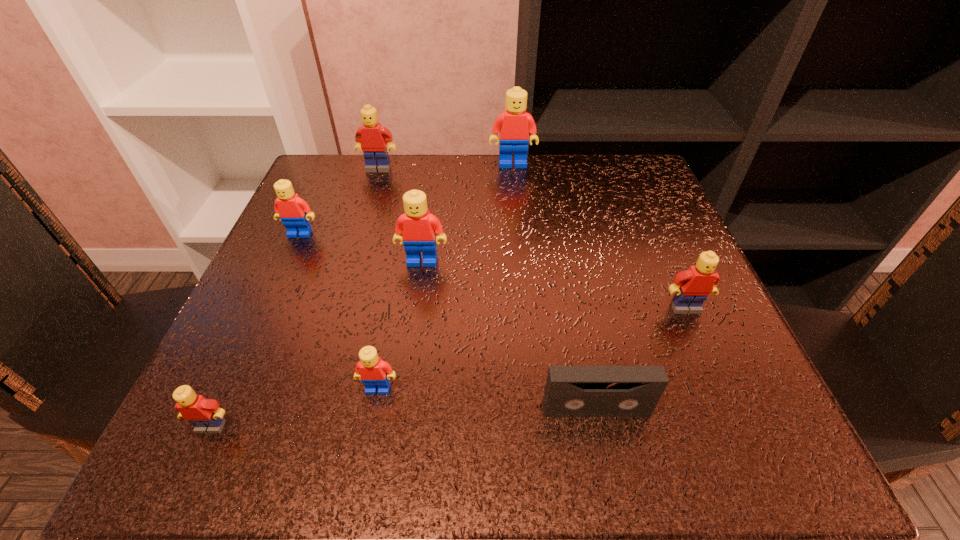
This screenshot has height=540, width=960. I want to click on the biggest red Lego, so click(x=513, y=125).

Where is `the tallest Lego`? The image size is (960, 540). the tallest Lego is located at coordinates (513, 125).

I want to click on the third object from left to right, so coord(372,138).

I want to click on the fifth Lego from right to left, so click(x=372, y=138).

You are a GUI agent. You are given a task and a screenshot of the screen. Output one action in this format:
    pyautogui.click(x=<x>, y=<y>)
    Task: Click on the second biggest red Lego
    
    Given the screenshot: What is the action you would take?
    pyautogui.click(x=419, y=227)

Identify the location of the fourth farthest Lego. This screenshot has width=960, height=540. (419, 227).

You are a GUI agent. You are given a task and a screenshot of the screen. Output one action in this format:
    pyautogui.click(x=<x>, y=<y>)
    Task: Click on the rightmost Lego
    
    Given the screenshot: What is the action you would take?
    pyautogui.click(x=693, y=286)

At what (x,y) coordinates should I click in order to perform the action: click on the second nearest yellow Lego. Please return your answer as a coordinate pair (x, y). Looking at the image, I should click on (693, 286).

This screenshot has height=540, width=960. Find the location of `the third farthest Lego`. the third farthest Lego is located at coordinates (294, 212).

The height and width of the screenshot is (540, 960). What are the coordinates of `the third farthest object` in the screenshot? It's located at (294, 212).